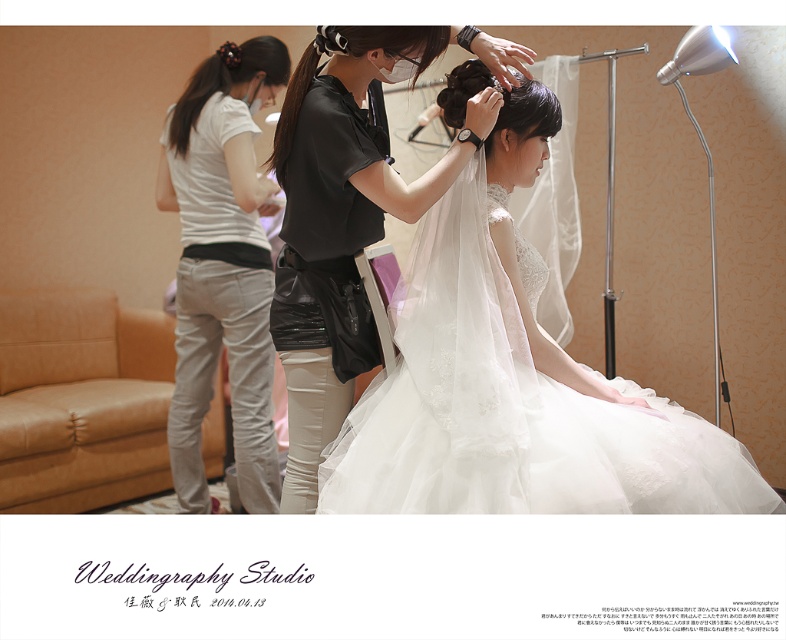
You are standing in the studio and want to place a new accessory exactly at the center of the white cotton shirt at center. Where should you place it?

The center of the white cotton shirt at center is located at the coordinates point [222,264].

You are a photographer positioned at the back of the studio. You need to capture a clear shot of both the white lace dress at center and the white cotton shirt at center. Which one will appear larger in your photo?

The white lace dress at center will appear larger in the photo because it is closer to the viewer than the white cotton shirt at center.